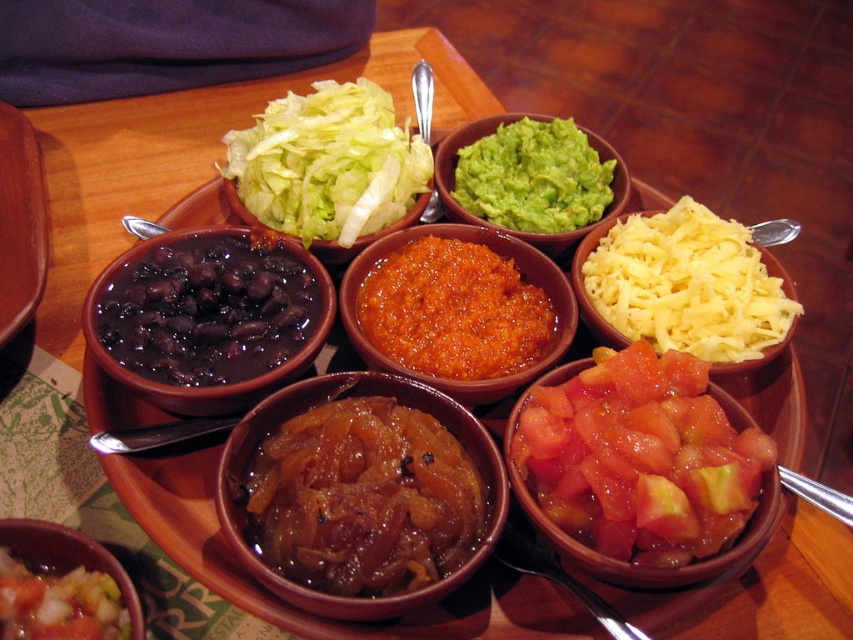
You are preparing to serve a dish and need to know the spatial relationship between the yellow shredded cheese at center right and the green smooth guacamole at center right. Which one is wider?

The yellow shredded cheese at center right is wider than the green smooth guacamole at center right according to the description provided.